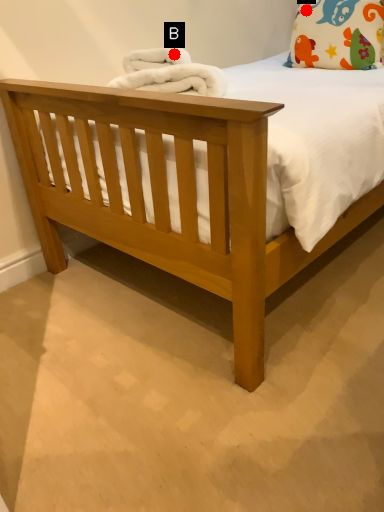
Question: Two points are circled on the image, labeled by A and B beside each circle. Which of the following is the closest to the observer?

Choices:
 (A) A is closer
 (B) B is closer

Answer: (B)